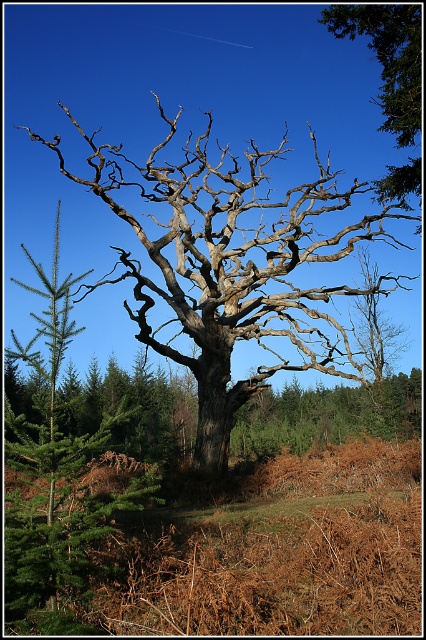
Who is more forward, (x=253, y=314) or (x=394, y=122)?

Point (x=394, y=122) is in front.

What do you see at coordinates (232, 264) in the screenshot? I see `dead wood tree at center` at bounding box center [232, 264].

The image size is (426, 640). What are the coordinates of `dead wood tree at center` in the screenshot? It's located at (232, 264).